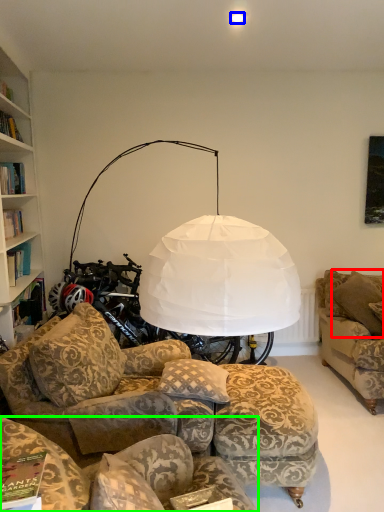
Question: Based on their relative distances, which object is farther from pillow (highlighted by a red box)? Choose from lighting (highlighted by a blue box) and studio couch (highlighted by a green box).

Choices:
 (A) lighting
 (B) studio couch

Answer: (A)